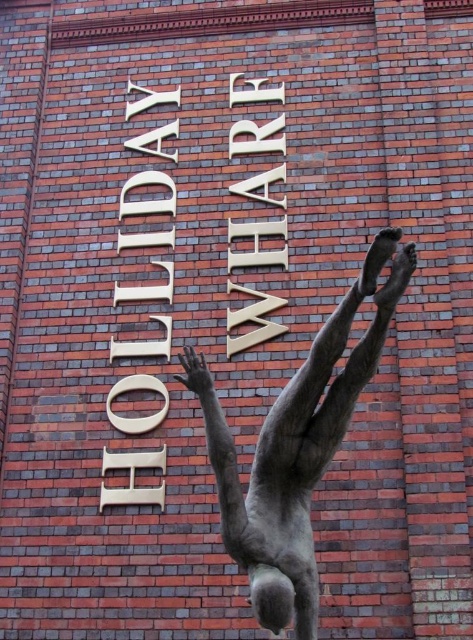
Can you confirm if polished bronze diver at center is wider than gold metallic sign at center?

Yes.

Is polished bronze diver at center smaller than gold metallic sign at center?

Incorrect, polished bronze diver at center is not smaller in size than gold metallic sign at center.

Is point (278, 442) closer to viewer compared to point (165, 129)?

Yes.

The width and height of the screenshot is (473, 640). Identify the location of polished bronze diver at center. (296, 448).